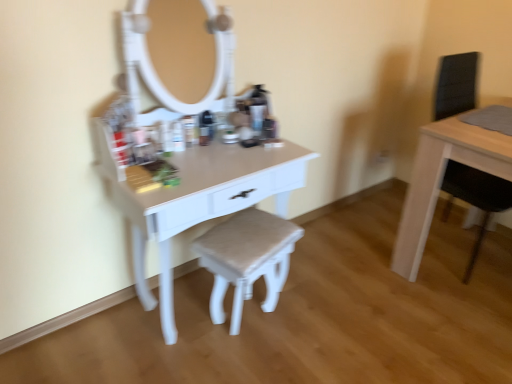
At what (x,y) coordinates should I click in order to perform the action: click on vacant space that is in between white glossy table at center, marked as the 1th table in a left-to-right arrangement, and light wood table at right, acting as the first table starting from the right. Please return your answer as a coordinate pair (x, y). Image resolution: width=512 pixels, height=384 pixels. Looking at the image, I should click on (348, 274).